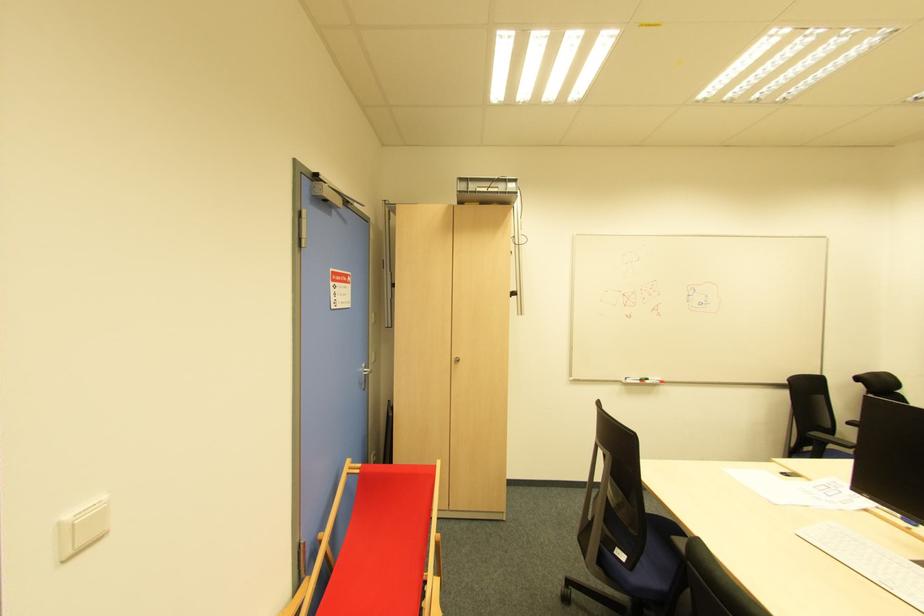
Describe the element at coordinates (831, 440) in the screenshot. I see `the black chair armrest` at that location.